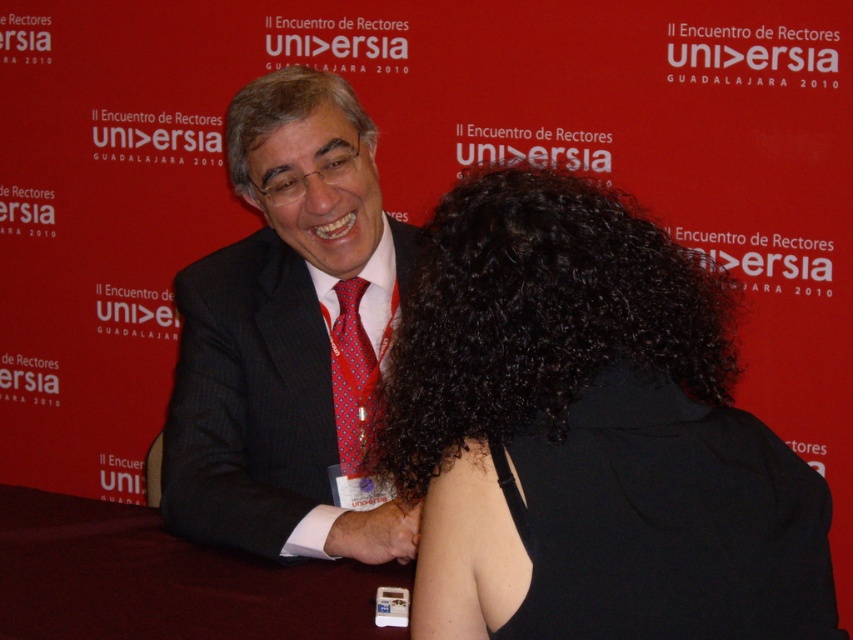
Question: Does gray curly hair at center appear over red silk tie at center?

Choices:
 (A) no
 (B) yes

Answer: (B)

Question: Which point appears farthest from the camera in this image?

Choices:
 (A) (338, 403)
 (B) (282, 104)
 (C) (364, 332)

Answer: (C)

Question: Based on their relative distances, which object is nearer to the black curly hair at center?

Choices:
 (A) gray curly hair at center
 (B) dark gray suit at center
 (C) red silk tie at center

Answer: (B)

Question: Considering the relative positions of dark gray suit at center and red silk tie at center in the image provided, where is dark gray suit at center located with respect to red silk tie at center?

Choices:
 (A) left
 (B) right

Answer: (A)

Question: Can you confirm if gray curly hair at center is positioned to the right of red silk tie at center?

Choices:
 (A) no
 (B) yes

Answer: (A)

Question: Which point is farther to the camera?

Choices:
 (A) (340, 458)
 (B) (328, 234)
 (C) (532, 582)

Answer: (A)